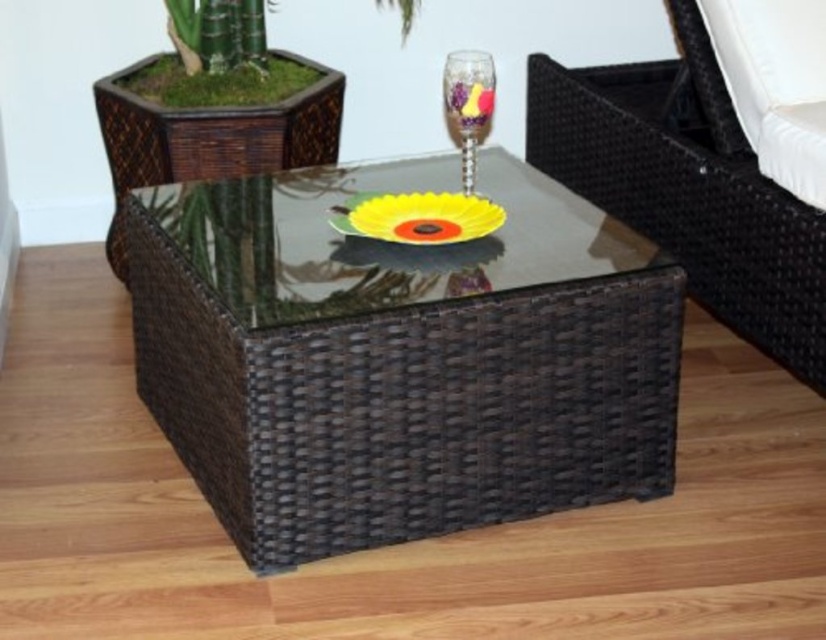
Based on the photo, is brown wicker table at center closer to camera compared to translucent glass wine glass at center?

That is True.

Who is more distant from viewer, [287,429] or [476,122]?

The point [476,122] is more distant.

Measure the distance between brown wicker table at center and camera.

brown wicker table at center and camera are 1.46 meters apart.

This screenshot has width=826, height=640. In order to click on brown wicker table at center in this screenshot , I will do `click(399, 356)`.

Is brown wicker chair at center further to camera compared to translucent glass flower at center?

No, brown wicker chair at center is closer to the viewer.

Between brown wicker chair at center and translucent glass flower at center, which one has less height?

Standing shorter between the two is translucent glass flower at center.

Is point (776, 266) farther from camera compared to point (487, 100)?

That is True.

The width and height of the screenshot is (826, 640). In order to click on brown wicker chair at center in this screenshot , I will do `click(687, 186)`.

Describe the element at coordinates (687, 186) in the screenshot. I see `brown wicker chair at center` at that location.

Between brown wicker chair at center and translucent glass wine glass at center, which one appears on the right side from the viewer's perspective?

brown wicker chair at center is more to the right.

At what (x,y) coordinates should I click in order to perform the action: click on brown wicker chair at center. Please return your answer as a coordinate pair (x, y). Looking at the image, I should click on (687, 186).

The width and height of the screenshot is (826, 640). Find the location of `brown wicker chair at center`. brown wicker chair at center is located at coordinates (687, 186).